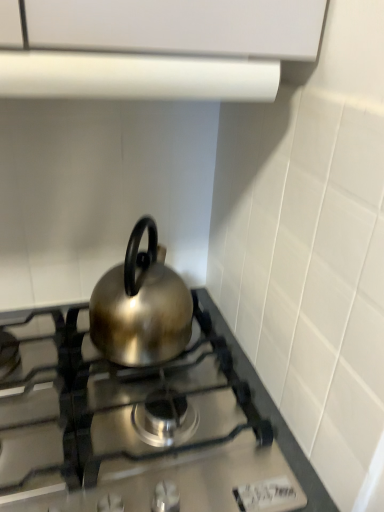
Question: Relative to white matte vent at upper center, is satin silver kettle at center in front or behind?

Choices:
 (A) behind
 (B) front

Answer: (A)

Question: Is satin silver kettle at center to the left or to the right of white matte vent at upper center in the image?

Choices:
 (A) right
 (B) left

Answer: (B)

Question: Which object is the farthest from the shiny metallic kettle at center?

Choices:
 (A) satin silver kettle at center
 (B) white matte vent at upper center

Answer: (B)

Question: Which object is positioned closest to the white matte vent at upper center?

Choices:
 (A) satin silver kettle at center
 (B) shiny metallic kettle at center

Answer: (B)